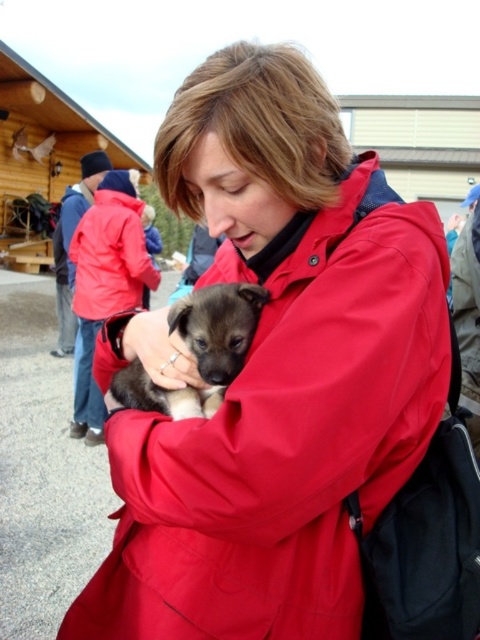
Question: Which object is positioned farthest from the matte red trench coat at center?

Choices:
 (A) brown fur puppy at center
 (B) matte red jacket at upper left

Answer: (B)

Question: Does brown fur puppy at center appear on the left side of matte red jacket at upper left?

Choices:
 (A) yes
 (B) no

Answer: (B)

Question: Which object appears farthest from the camera in this image?

Choices:
 (A) matte red trench coat at center
 (B) matte red jacket at upper left

Answer: (B)

Question: Is matte red jacket at upper left to the right of matte red trench coat at center from the viewer's perspective?

Choices:
 (A) no
 (B) yes

Answer: (A)

Question: Does matte red jacket at upper left have a larger size compared to matte red trench coat at center?

Choices:
 (A) yes
 (B) no

Answer: (B)

Question: Which point appears closest to the camera in this image?

Choices:
 (A) (155, 282)
 (B) (255, 289)
 (C) (479, 417)

Answer: (B)